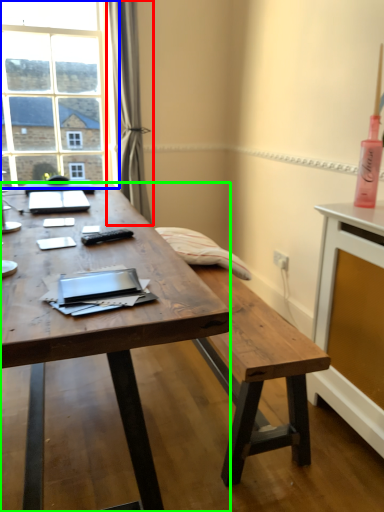
Question: Which object is the farthest from curtain (highlighted by a red box)? Choose among these: window (highlighted by a blue box) or desk (highlighted by a green box).

Choices:
 (A) window
 (B) desk

Answer: (B)